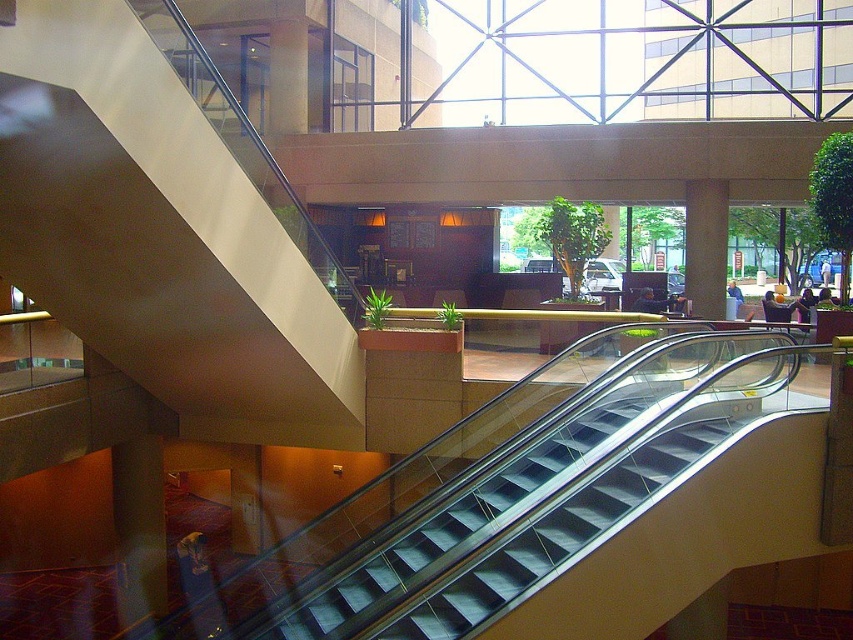
In the scene shown: Is metallic silver escalator at center thinner than matte brown pillar at center?

In fact, metallic silver escalator at center might be wider than matte brown pillar at center.

Which of these two, metallic silver escalator at center or matte brown pillar at center, stands shorter?

With less height is metallic silver escalator at center.

Locate an element on the screen. This screenshot has width=853, height=640. metallic silver escalator at center is located at coordinates (467, 515).